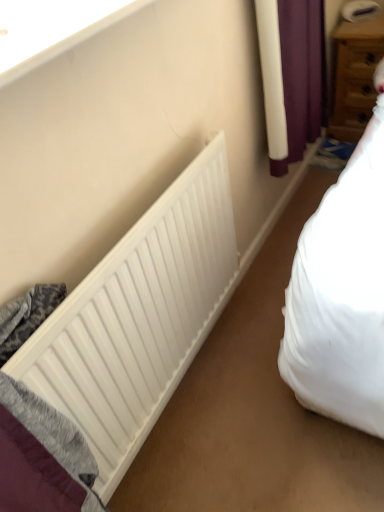
Question: Is white matte radiator at lower left taller than white smooth window sill at upper left?

Choices:
 (A) no
 (B) yes

Answer: (B)

Question: Does white matte radiator at lower left appear on the right side of white smooth window sill at upper left?

Choices:
 (A) yes
 (B) no

Answer: (A)

Question: Is white matte radiator at lower left aimed at white smooth window sill at upper left?

Choices:
 (A) no
 (B) yes

Answer: (A)

Question: From the image's perspective, is white matte radiator at lower left located above white smooth window sill at upper left?

Choices:
 (A) no
 (B) yes

Answer: (A)

Question: Is white matte radiator at lower left further to the viewer compared to white smooth window sill at upper left?

Choices:
 (A) yes
 (B) no

Answer: (A)

Question: Based on their sizes in the image, would you say wooden drawer at upper right is bigger or smaller than white smooth window sill at upper left?

Choices:
 (A) small
 (B) big

Answer: (B)

Question: In the image, is wooden drawer at upper right on the left side or the right side of white smooth window sill at upper left?

Choices:
 (A) right
 (B) left

Answer: (A)

Question: Considering the positions of point (364, 108) and point (16, 56), is point (364, 108) closer or farther from the camera than point (16, 56)?

Choices:
 (A) closer
 (B) farther

Answer: (B)

Question: Is wooden drawer at upper right wider or thinner than white smooth window sill at upper left?

Choices:
 (A) thin
 (B) wide

Answer: (B)

Question: Is white matte radiator at lower left wider or thinner than wooden drawer at upper right?

Choices:
 (A) wide
 (B) thin

Answer: (B)

Question: Visually, is white matte radiator at lower left positioned to the left or to the right of wooden drawer at upper right?

Choices:
 (A) left
 (B) right

Answer: (A)

Question: Does point (104, 458) appear closer or farther from the camera than point (337, 74)?

Choices:
 (A) closer
 (B) farther

Answer: (A)

Question: From the image's perspective, relative to wooden drawer at upper right, is white matte radiator at lower left above or below?

Choices:
 (A) below
 (B) above

Answer: (A)

Question: Considering the positions of white smooth window sill at upper left and white matte radiator at lower left in the image, is white smooth window sill at upper left taller or shorter than white matte radiator at lower left?

Choices:
 (A) short
 (B) tall

Answer: (A)

Question: Is white smooth window sill at upper left inside or outside of white matte radiator at lower left?

Choices:
 (A) outside
 (B) inside

Answer: (A)